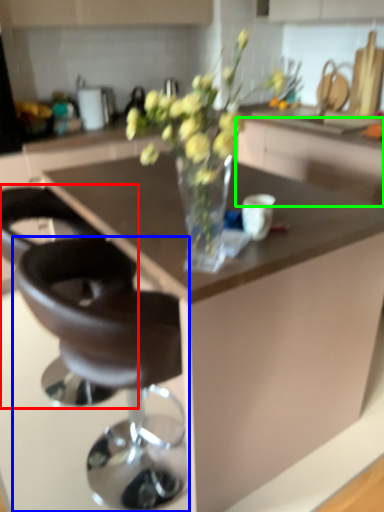
Question: Which object is the farthest from chair (highlighted by a red box)? Choose among these: chair (highlighted by a blue box) or cabinetry (highlighted by a green box).

Choices:
 (A) chair
 (B) cabinetry

Answer: (B)